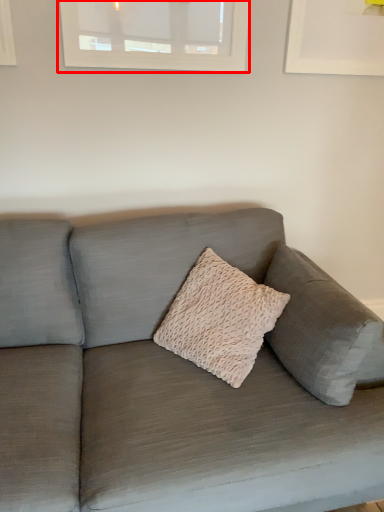
Question: From the image's perspective, what is the correct spatial positioning of window (annotated by the red box) in reference to studio couch?

Choices:
 (A) above
 (B) below

Answer: (A)